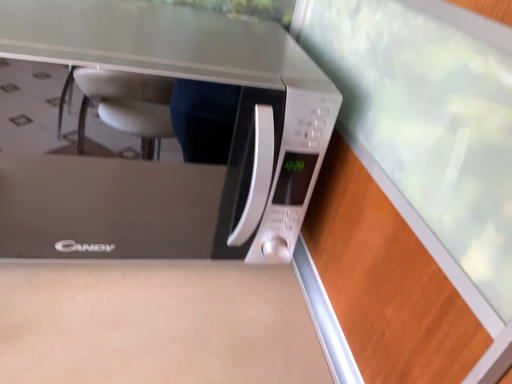
Image resolution: width=512 pixels, height=384 pixels. In order to click on satin silver microwave at center in this screenshot , I will do `click(156, 164)`.

In order to face satin silver microwave at center, should I rotate leftwards or rightwards?

To align with it, rotate left about 14.307°.

The height and width of the screenshot is (384, 512). What do you see at coordinates (156, 164) in the screenshot? I see `satin silver microwave at center` at bounding box center [156, 164].

I want to click on satin silver microwave at center, so click(x=156, y=164).